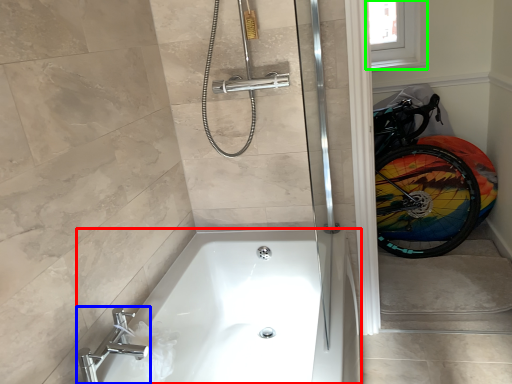
Question: Estimate the real-world distances between objects in this image. Which object is closer to bathtub (highlighted by a red box), tap (highlighted by a blue box) or window screen (highlighted by a green box)?

Choices:
 (A) tap
 (B) window screen

Answer: (A)